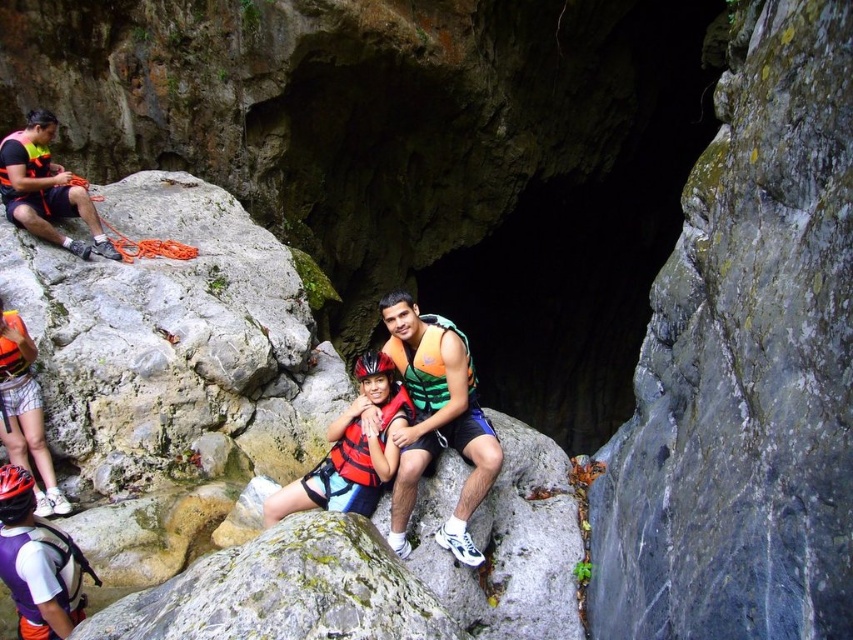
Question: Can you confirm if orange life vest at center is smaller than matte black rope at left?

Choices:
 (A) no
 (B) yes

Answer: (A)

Question: Is orange life vest at center below matte black rope at left?

Choices:
 (A) yes
 (B) no

Answer: (A)

Question: Which point appears closest to the camera in this image?

Choices:
 (A) (476, 467)
 (B) (7, 189)

Answer: (A)

Question: Is orange life vest at center to the right of matte black rope at left from the viewer's perspective?

Choices:
 (A) no
 (B) yes

Answer: (B)

Question: Which point is closer to the camera taking this photo?

Choices:
 (A) (51, 236)
 (B) (456, 529)

Answer: (B)